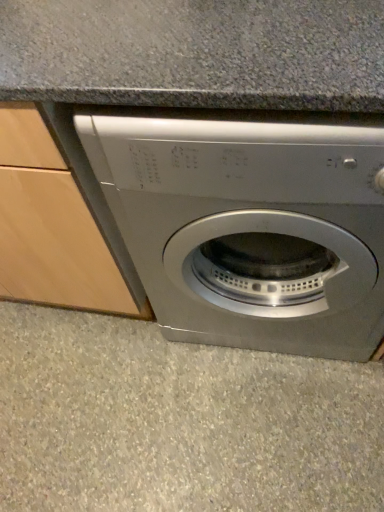
Question: Considering the relative sizes of gray speckled concrete at lower center and satin silver washing machine at center in the image provided, is gray speckled concrete at lower center smaller than satin silver washing machine at center?

Choices:
 (A) no
 (B) yes

Answer: (B)

Question: Is gray speckled concrete at lower center bigger than satin silver washing machine at center?

Choices:
 (A) no
 (B) yes

Answer: (A)

Question: From the image's perspective, is gray speckled concrete at lower center located above satin silver washing machine at center?

Choices:
 (A) no
 (B) yes

Answer: (A)

Question: Can you confirm if gray speckled concrete at lower center is shorter than satin silver washing machine at center?

Choices:
 (A) yes
 (B) no

Answer: (A)

Question: From a real-world perspective, is gray speckled concrete at lower center over satin silver washing machine at center?

Choices:
 (A) yes
 (B) no

Answer: (B)

Question: Is gray speckled concrete at lower center at the right side of satin silver washing machine at center?

Choices:
 (A) no
 (B) yes

Answer: (A)

Question: Is satin silver washing machine at center taller than gray speckled concrete at lower center?

Choices:
 (A) no
 (B) yes

Answer: (B)

Question: Are satin silver washing machine at center and gray speckled concrete at lower center making contact?

Choices:
 (A) no
 (B) yes

Answer: (A)

Question: Is satin silver washing machine at center not within gray speckled concrete at lower center?

Choices:
 (A) no
 (B) yes

Answer: (B)

Question: From a real-world perspective, is satin silver washing machine at center physically above gray speckled concrete at lower center?

Choices:
 (A) yes
 (B) no

Answer: (A)

Question: Is satin silver washing machine at center shorter than gray speckled concrete at lower center?

Choices:
 (A) no
 (B) yes

Answer: (A)

Question: From a real-world perspective, is satin silver washing machine at center positioned under gray speckled concrete at lower center based on gravity?

Choices:
 (A) yes
 (B) no

Answer: (B)

Question: From the image's perspective, is gray speckled concrete at lower center above or below satin silver washing machine at center?

Choices:
 (A) below
 (B) above

Answer: (A)